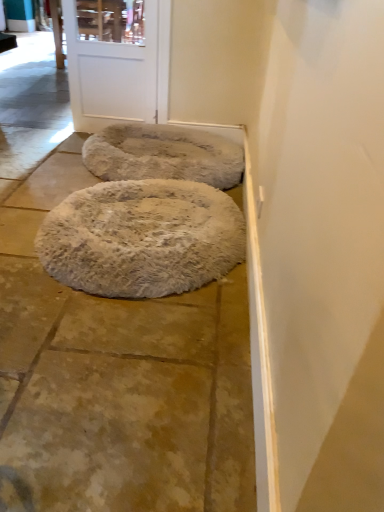
Question: From a real-world perspective, is white matte door at upper center physically below white fluffy dog bed at center, which appears as the 1th dog bed when viewed from the front?

Choices:
 (A) yes
 (B) no

Answer: (B)

Question: Is white matte door at upper center far away from white fluffy dog bed at center, which appears as the 1th dog bed when viewed from the front?

Choices:
 (A) yes
 (B) no

Answer: (A)

Question: Does white matte door at upper center turn towards white fluffy dog bed at center, the second dog bed viewed from the back?

Choices:
 (A) yes
 (B) no

Answer: (A)

Question: Is white fluffy dog bed at center, the second dog bed viewed from the back, surrounded by white matte door at upper center?

Choices:
 (A) no
 (B) yes

Answer: (A)

Question: From a real-world perspective, is white matte door at upper center positioned over white fluffy dog bed at center, which appears as the 1th dog bed when viewed from the front, based on gravity?

Choices:
 (A) yes
 (B) no

Answer: (A)

Question: Does white matte door at upper center appear on the right side of white fluffy dog bed at center, the second dog bed viewed from the back?

Choices:
 (A) yes
 (B) no

Answer: (B)

Question: Are white fluffy rug at center and white matte door at upper center beside each other?

Choices:
 (A) yes
 (B) no

Answer: (B)

Question: Is there a large distance between white fluffy rug at center and white matte door at upper center?

Choices:
 (A) no
 (B) yes

Answer: (B)

Question: From a real-world perspective, is white fluffy rug at center below white matte door at upper center?

Choices:
 (A) yes
 (B) no

Answer: (A)

Question: Can you confirm if white fluffy rug at center is thinner than white matte door at upper center?

Choices:
 (A) no
 (B) yes

Answer: (A)

Question: Is white fluffy rug at center bigger than white matte door at upper center?

Choices:
 (A) yes
 (B) no

Answer: (A)

Question: Does white fluffy rug at center come in front of white matte door at upper center?

Choices:
 (A) no
 (B) yes

Answer: (B)

Question: Can you confirm if white fluffy dog bed at center, which appears as the 1th dog bed when viewed from the front, is wider than white fluffy rug at center?

Choices:
 (A) no
 (B) yes

Answer: (A)